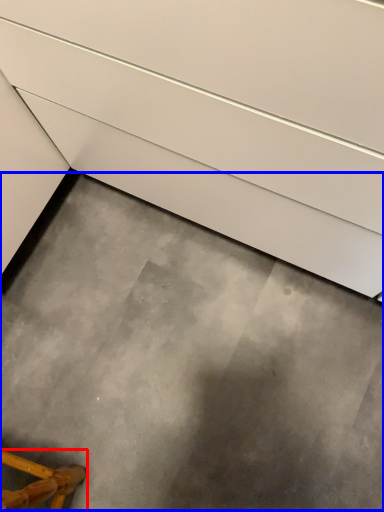
Question: Which point is further to the camera, furniture (highlighted by a red box) or concrete (highlighted by a blue box)?

Choices:
 (A) furniture
 (B) concrete

Answer: (B)